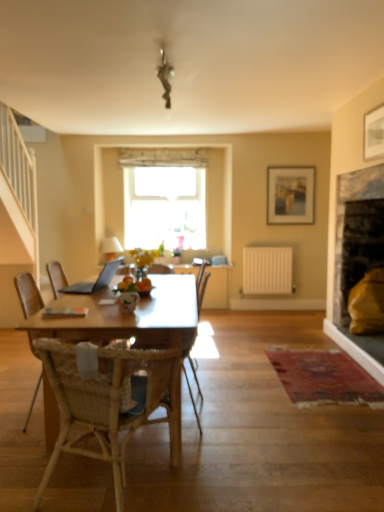
Question: Which is correct: woven wood chair at center, which is counted as the second chair, starting from the back, is inside woven wood chair at center, which is the 1th chair from front to back, or outside of it?

Choices:
 (A) inside
 (B) outside

Answer: (B)

Question: Visually, is woven wood chair at center, which is counted as the second chair, starting from the back, positioned to the left or to the right of woven wood chair at center, which ranks as the third chair in back-to-front order?

Choices:
 (A) right
 (B) left

Answer: (B)

Question: Which object is the closest to the matte wooden picture frame at upper center, the 2th picture frame from the front?

Choices:
 (A) woven wood chair at center, which is the 1th chair from front to back
 (B) woven wood chair at center, the 3th chair when ordered from front to back
 (C) white matte radiator at center-right
 (D) silver metallic laptop at center
 (E) white glossy vase at center

Answer: (C)

Question: Based on their relative distances, which object is nearer to the transparent glass window at center?

Choices:
 (A) woven wood chair at center, acting as the second chair starting from the front
 (B) woven wood chair at center, the 1th chair when ordered from back to front
 (C) silver metallic laptop at center
 (D) white matte radiator at center-right
 (E) woven wood chair at center, which ranks as the third chair in back-to-front order

Answer: (D)